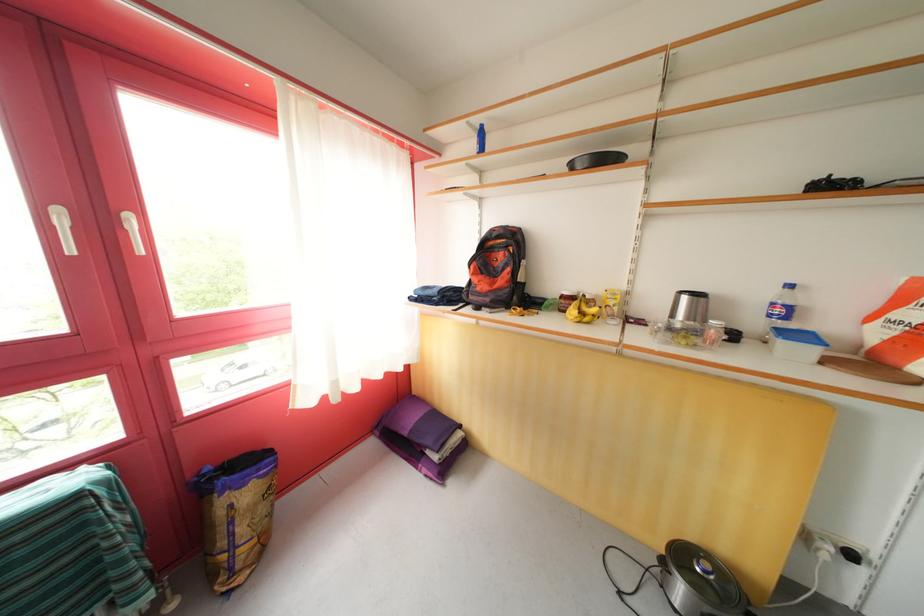
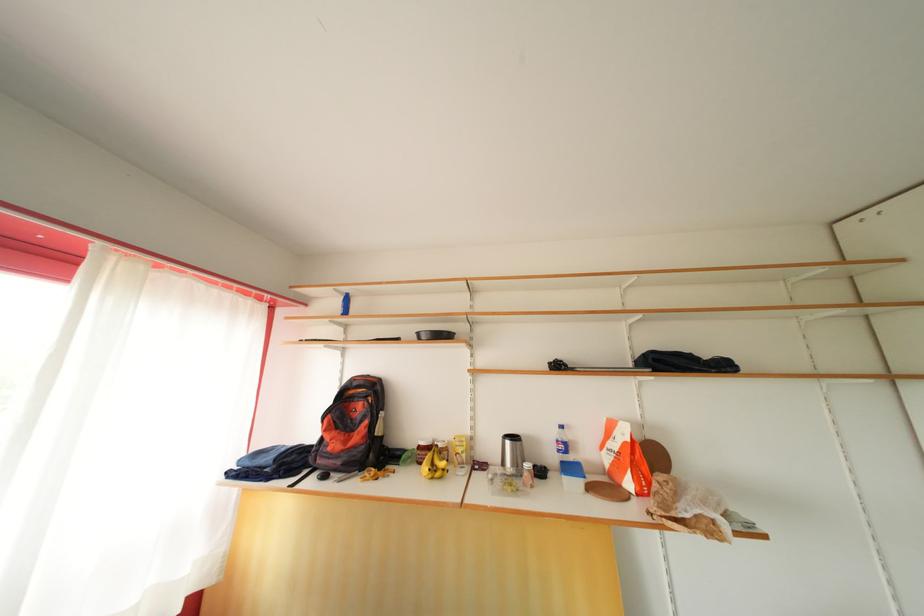
In the second image, find the point that corresponds to the point at 691,304 in the first image.

(515, 448)